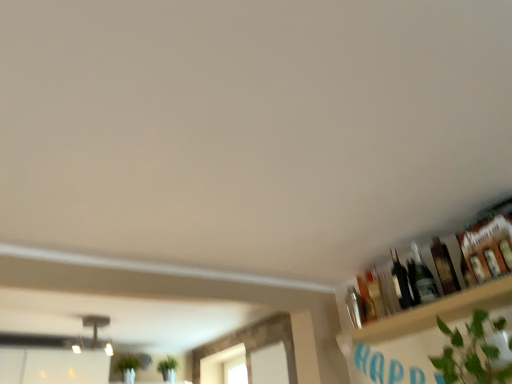
Question: From the image's perspective, is wooden shelf at upper right above translucent glass bottle at upper right, which ranks as the first bottle in right-to-left order?

Choices:
 (A) yes
 (B) no

Answer: (B)

Question: Is wooden shelf at upper right outside translucent glass bottle at upper right, which ranks as the fourth bottle in left-to-right order?

Choices:
 (A) yes
 (B) no

Answer: (A)

Question: Is wooden shelf at upper right far from translucent glass bottle at upper right, which ranks as the fourth bottle in left-to-right order?

Choices:
 (A) yes
 (B) no

Answer: (B)

Question: Could translucent glass bottle at upper right, which ranks as the first bottle in right-to-left order, be considered to be inside wooden shelf at upper right?

Choices:
 (A) yes
 (B) no

Answer: (B)

Question: Considering the relative positions of wooden shelf at upper right and translucent glass bottle at upper right, which ranks as the first bottle in right-to-left order, in the image provided, is wooden shelf at upper right behind translucent glass bottle at upper right, which ranks as the first bottle in right-to-left order,?

Choices:
 (A) no
 (B) yes

Answer: (A)

Question: Is wooden shelf at upper right oriented away from translucent glass bottle at upper right, which ranks as the fourth bottle in left-to-right order?

Choices:
 (A) no
 (B) yes

Answer: (A)

Question: Does translucent glass bottle at upper right, positioned as the 3th bottle in left-to-right order, have a greater height compared to translucent glass bottle at upper right, which ranks as the first bottle in right-to-left order?

Choices:
 (A) yes
 (B) no

Answer: (A)

Question: Is translucent glass bottle at upper right, positioned as the 3th bottle in left-to-right order, oriented away from translucent glass bottle at upper right, which ranks as the first bottle in right-to-left order?

Choices:
 (A) yes
 (B) no

Answer: (B)

Question: Is translucent glass bottle at upper right, positioned as the 3th bottle in left-to-right order, next to translucent glass bottle at upper right, which ranks as the fourth bottle in left-to-right order, and touching it?

Choices:
 (A) no
 (B) yes

Answer: (B)

Question: From the image's perspective, would you say translucent glass bottle at upper right, acting as the 2th bottle starting from the right, is shown under translucent glass bottle at upper right, which ranks as the fourth bottle in left-to-right order?

Choices:
 (A) yes
 (B) no

Answer: (A)

Question: Is translucent glass bottle at upper right, which ranks as the first bottle in right-to-left order, completely or partially inside translucent glass bottle at upper right, acting as the 2th bottle starting from the right?

Choices:
 (A) no
 (B) yes

Answer: (A)

Question: Is translucent glass bottle at upper right, acting as the 2th bottle starting from the right, positioned behind translucent glass bottle at upper right, which ranks as the first bottle in right-to-left order?

Choices:
 (A) yes
 (B) no

Answer: (A)

Question: From the image's perspective, is wooden shelf at upper right on translucent glass bottle at upper right, acting as the 2th bottle starting from the right?

Choices:
 (A) no
 (B) yes

Answer: (A)